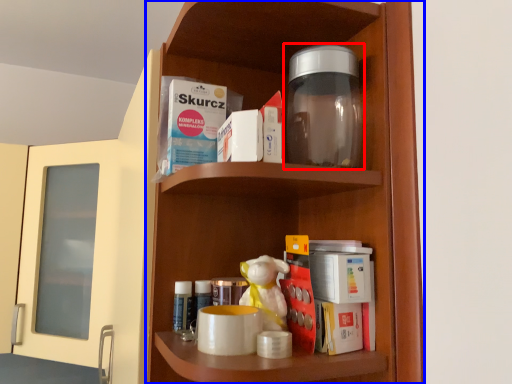
Question: Among these objects, which one is nearest to the camera, bottle (highlighted by a red box) or shelf (highlighted by a blue box)?

Choices:
 (A) bottle
 (B) shelf

Answer: (B)